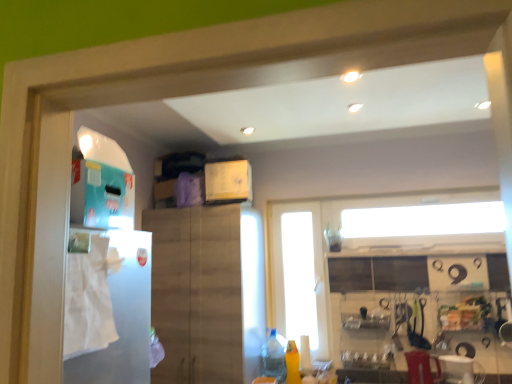
Question: From the image's perspective, is yellow matte bottle at lower center, which is the 1th bottle from right to left, over clear plastic bottle at lower center, positioned as the 2th bottle in right-to-left order?

Choices:
 (A) yes
 (B) no

Answer: (A)

Question: Are yellow matte bottle at lower center, which is the 1th bottle from right to left, and clear plastic bottle at lower center, positioned as the 2th bottle in right-to-left order, far apart?

Choices:
 (A) no
 (B) yes

Answer: (A)

Question: Is yellow matte bottle at lower center, the 2th bottle positioned from the left, located outside clear plastic bottle at lower center, positioned as the 2th bottle in right-to-left order?

Choices:
 (A) yes
 (B) no

Answer: (A)

Question: From a real-world perspective, is yellow matte bottle at lower center, the 2th bottle positioned from the left, physically below clear plastic bottle at lower center, positioned as the 2th bottle in right-to-left order?

Choices:
 (A) yes
 (B) no

Answer: (A)

Question: Can you confirm if yellow matte bottle at lower center, the 2th bottle positioned from the left, is positioned to the right of clear plastic bottle at lower center, positioned as the 2th bottle in right-to-left order?

Choices:
 (A) yes
 (B) no

Answer: (A)

Question: Is yellow matte bottle at lower center, the 2th bottle positioned from the left, positioned before clear plastic bottle at lower center, the first bottle viewed from the left?

Choices:
 (A) yes
 (B) no

Answer: (B)

Question: Is white paper towel at left bigger than yellow matte bottle at lower center, the 2th bottle positioned from the left?

Choices:
 (A) yes
 (B) no

Answer: (A)

Question: Can you confirm if white paper towel at left is wider than yellow matte bottle at lower center, which is the 1th bottle from right to left?

Choices:
 (A) yes
 (B) no

Answer: (B)

Question: Is white paper towel at left closer to camera compared to yellow matte bottle at lower center, which is the 1th bottle from right to left?

Choices:
 (A) yes
 (B) no

Answer: (A)

Question: Can yellow matte bottle at lower center, the 2th bottle positioned from the left, be found inside white paper towel at left?

Choices:
 (A) yes
 (B) no

Answer: (B)

Question: From the image's perspective, is white paper towel at left located beneath yellow matte bottle at lower center, which is the 1th bottle from right to left?

Choices:
 (A) no
 (B) yes

Answer: (A)

Question: Is the surface of white paper towel at left in direct contact with yellow matte bottle at lower center, the 2th bottle positioned from the left?

Choices:
 (A) no
 (B) yes

Answer: (A)

Question: Can you confirm if clear plastic bottle at lower center, the first bottle viewed from the left, is positioned to the right of white paper towel at left?

Choices:
 (A) no
 (B) yes

Answer: (B)